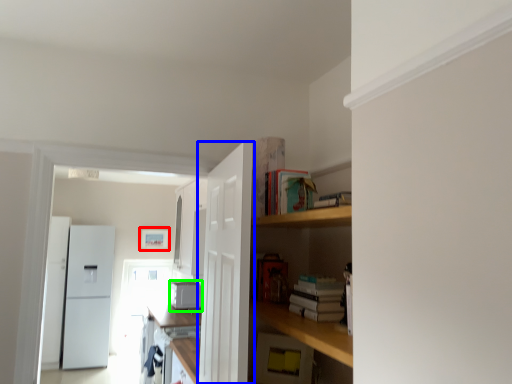
Question: Which object is positioned farthest from picture frame (highlighted by a red box)? Select from door (highlighted by a blue box) and appliance (highlighted by a green box).

Choices:
 (A) door
 (B) appliance

Answer: (A)